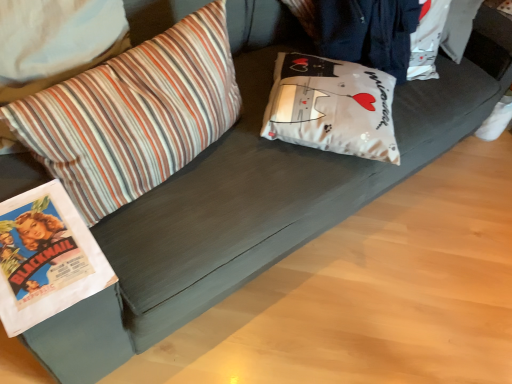
In order to face white matte pillow at center, acting as the 2th pillow starting from the left, should I rotate leftwards or rightwards?

Turn right by 10.717 degrees to look at white matte pillow at center, acting as the 2th pillow starting from the left.

What do you see at coordinates (332, 107) in the screenshot?
I see `white matte pillow at center, acting as the 2th pillow starting from the left` at bounding box center [332, 107].

At what (x,y) coordinates should I click in order to perform the action: click on white matte pillow at center, acting as the 2th pillow starting from the left. Please return your answer as a coordinate pair (x, y). The width and height of the screenshot is (512, 384). Looking at the image, I should click on (332, 107).

Where is `striped fabric pillow at left, which is the 1th pillow in left-to-right order`? striped fabric pillow at left, which is the 1th pillow in left-to-right order is located at coordinates (134, 114).

Image resolution: width=512 pixels, height=384 pixels. What do you see at coordinates (134, 114) in the screenshot?
I see `striped fabric pillow at left, positioned as the 2th pillow in right-to-left order` at bounding box center [134, 114].

In order to face striped fabric pillow at left, which is the 1th pillow in left-to-right order, should I rotate leftwards or rightwards?

Turn left by 14.107 degrees to look at striped fabric pillow at left, which is the 1th pillow in left-to-right order.

What is the approximate width of striped fabric pillow at left, which is the 1th pillow in left-to-right order?

It is 10.32 inches.

Find the location of a particular element. This screenshot has height=384, width=512. white matte pillow at center, arranged as the first pillow when viewed from the right is located at coordinates (332, 107).

From the picture: Does white matte pillow at center, arranged as the first pillow when viewed from the right, appear on the right side of striped fabric pillow at left, positioned as the 2th pillow in right-to-left order?

Indeed, white matte pillow at center, arranged as the first pillow when viewed from the right, is positioned on the right side of striped fabric pillow at left, positioned as the 2th pillow in right-to-left order.

Which object is further away from the camera, white matte pillow at center, acting as the 2th pillow starting from the left, or striped fabric pillow at left, positioned as the 2th pillow in right-to-left order?

Positioned behind is white matte pillow at center, acting as the 2th pillow starting from the left.

Does point (298, 130) appear closer or farther from the camera than point (200, 41)?

Point (298, 130) is positioned farther from the camera compared to point (200, 41).

From the image's perspective, is white matte pillow at center, arranged as the first pillow when viewed from the right, positioned above or below striped fabric pillow at left, positioned as the 2th pillow in right-to-left order?

Based on their image positions, white matte pillow at center, arranged as the first pillow when viewed from the right, is located above striped fabric pillow at left, positioned as the 2th pillow in right-to-left order.

From a real-world perspective, who is located lower, white matte pillow at center, acting as the 2th pillow starting from the left, or striped fabric pillow at left, positioned as the 2th pillow in right-to-left order?

white matte pillow at center, acting as the 2th pillow starting from the left, is physically lower.

Which object is thinner, white matte pillow at center, arranged as the first pillow when viewed from the right, or striped fabric pillow at left, which is the 1th pillow in left-to-right order?

Thinner between the two is striped fabric pillow at left, which is the 1th pillow in left-to-right order.

Considering the sizes of white matte pillow at center, arranged as the first pillow when viewed from the right, and striped fabric pillow at left, positioned as the 2th pillow in right-to-left order, in the image, is white matte pillow at center, arranged as the first pillow when viewed from the right, taller or shorter than striped fabric pillow at left, positioned as the 2th pillow in right-to-left order,?

In the image, white matte pillow at center, arranged as the first pillow when viewed from the right, appears to be shorter than striped fabric pillow at left, positioned as the 2th pillow in right-to-left order.

Does white matte pillow at center, acting as the 2th pillow starting from the left, have a larger size compared to striped fabric pillow at left, positioned as the 2th pillow in right-to-left order?

No.

Do you think white matte pillow at center, acting as the 2th pillow starting from the left, is within striped fabric pillow at left, positioned as the 2th pillow in right-to-left order, or outside of it?

white matte pillow at center, acting as the 2th pillow starting from the left, is not inside striped fabric pillow at left, positioned as the 2th pillow in right-to-left order, it's outside.

Is white matte pillow at center, acting as the 2th pillow starting from the left, in contact with striped fabric pillow at left, which is the 1th pillow in left-to-right order?

white matte pillow at center, acting as the 2th pillow starting from the left, and striped fabric pillow at left, which is the 1th pillow in left-to-right order, are clearly separated.

Does white matte pillow at center, arranged as the first pillow when viewed from the right, turn towards striped fabric pillow at left, positioned as the 2th pillow in right-to-left order?

No, white matte pillow at center, arranged as the first pillow when viewed from the right, is not oriented towards striped fabric pillow at left, positioned as the 2th pillow in right-to-left order.

You are a GUI agent. You are given a task and a screenshot of the screen. Output one action in this format:
    pyautogui.click(x=<x>, y=<y>)
    Task: Click on the pillow that appears above the white matte pillow at center, arranged as the first pillow when viewed from the right (from a real-world perspective)
    Image resolution: width=512 pixels, height=384 pixels.
    Given the screenshot: What is the action you would take?
    pyautogui.click(x=134, y=114)

Considering the relative positions of striped fabric pillow at left, positioned as the 2th pillow in right-to-left order, and white matte pillow at center, arranged as the first pillow when viewed from the right, in the image provided, is striped fabric pillow at left, positioned as the 2th pillow in right-to-left order, to the left or to the right of white matte pillow at center, arranged as the first pillow when viewed from the right,?

striped fabric pillow at left, positioned as the 2th pillow in right-to-left order, is positioned on white matte pillow at center, arranged as the first pillow when viewed from the right,'s left side.

Which object is closer to the camera, striped fabric pillow at left, which is the 1th pillow in left-to-right order, or white matte pillow at center, arranged as the first pillow when viewed from the right?

striped fabric pillow at left, which is the 1th pillow in left-to-right order, is closer to the camera.

Which is in front, point (86, 125) or point (346, 77)?

The point (86, 125) is in front.

From the image's perspective, does striped fabric pillow at left, which is the 1th pillow in left-to-right order, appear higher than white matte pillow at center, arranged as the first pillow when viewed from the right?

Incorrect, from the image's perspective, striped fabric pillow at left, which is the 1th pillow in left-to-right order, is lower than white matte pillow at center, arranged as the first pillow when viewed from the right.

Looking at this image, from a real-world perspective, which is physically below, striped fabric pillow at left, positioned as the 2th pillow in right-to-left order, or white matte pillow at center, acting as the 2th pillow starting from the left?

white matte pillow at center, acting as the 2th pillow starting from the left.

Is striped fabric pillow at left, which is the 1th pillow in left-to-right order, wider than white matte pillow at center, arranged as the first pillow when viewed from the right?

In fact, striped fabric pillow at left, which is the 1th pillow in left-to-right order, might be narrower than white matte pillow at center, arranged as the first pillow when viewed from the right.

Which of these two, striped fabric pillow at left, positioned as the 2th pillow in right-to-left order, or white matte pillow at center, acting as the 2th pillow starting from the left, stands shorter?

white matte pillow at center, acting as the 2th pillow starting from the left.

Considering the relative sizes of striped fabric pillow at left, positioned as the 2th pillow in right-to-left order, and white matte pillow at center, acting as the 2th pillow starting from the left, in the image provided, is striped fabric pillow at left, positioned as the 2th pillow in right-to-left order, smaller than white matte pillow at center, acting as the 2th pillow starting from the left,?

No.

Is striped fabric pillow at left, positioned as the 2th pillow in right-to-left order, positioned beyond the bounds of white matte pillow at center, arranged as the first pillow when viewed from the right?

Indeed, striped fabric pillow at left, positioned as the 2th pillow in right-to-left order, is completely outside white matte pillow at center, arranged as the first pillow when viewed from the right.

Does striped fabric pillow at left, positioned as the 2th pillow in right-to-left order, touch white matte pillow at center, acting as the 2th pillow starting from the left?

No, striped fabric pillow at left, positioned as the 2th pillow in right-to-left order, is not in contact with white matte pillow at center, acting as the 2th pillow starting from the left.

Consider the image. Is striped fabric pillow at left, positioned as the 2th pillow in right-to-left order, aimed at white matte pillow at center, arranged as the first pillow when viewed from the right?

No.

At what (x,y) coordinates should I click in order to perform the action: click on pillow below the white matte pillow at center, arranged as the first pillow when viewed from the right (from the image's perspective). Please return your answer as a coordinate pair (x, y). The width and height of the screenshot is (512, 384). Looking at the image, I should click on (134, 114).

This screenshot has width=512, height=384. What are the coordinates of `pillow above the striped fabric pillow at left, which is the 1th pillow in left-to-right order (from the image's perspective)` in the screenshot? It's located at (332, 107).

You are a GUI agent. You are given a task and a screenshot of the screen. Output one action in this format:
    pyautogui.click(x=<x>, y=<y>)
    Task: Click on the pillow lying in front of the white matte pillow at center, arranged as the first pillow when viewed from the right
    The image size is (512, 384).
    Given the screenshot: What is the action you would take?
    pyautogui.click(x=134, y=114)